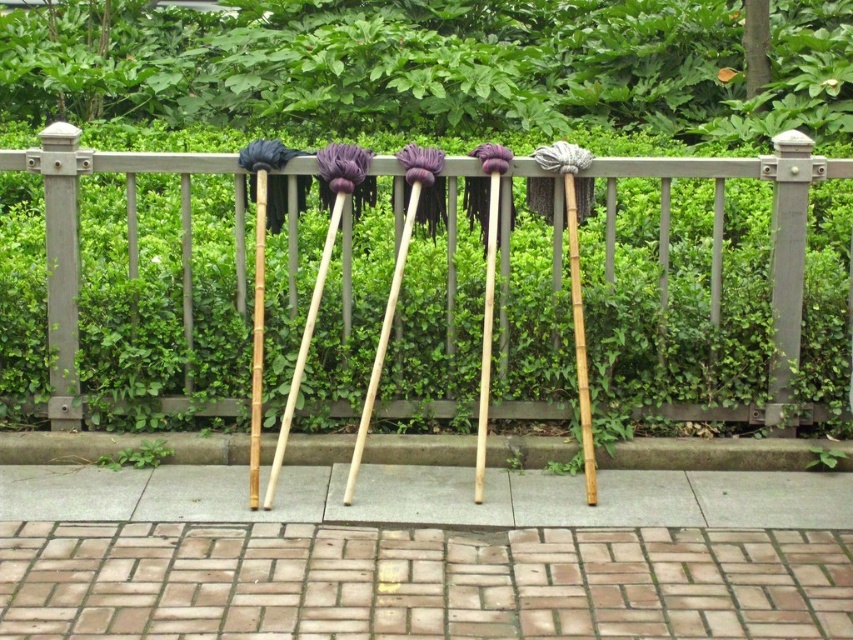
Question: Based on their relative distances, which object is farther from the green leafy hedge at upper center?

Choices:
 (A) wooden fence at center
 (B) brick paving at lower center

Answer: (B)

Question: Can you confirm if green leafy hedge at upper center is positioned below brick paving at lower center?

Choices:
 (A) yes
 (B) no

Answer: (B)

Question: Is wooden fence at center wider than green leafy hedge at upper center?

Choices:
 (A) yes
 (B) no

Answer: (A)

Question: Does wooden fence at center have a larger size compared to green leafy hedge at upper center?

Choices:
 (A) no
 (B) yes

Answer: (B)

Question: Which point is farther to the camera?

Choices:
 (A) (770, 605)
 (B) (775, 45)
 (C) (712, 196)

Answer: (B)

Question: Which point is closer to the camera?

Choices:
 (A) green leafy hedge at upper center
 (B) brick paving at lower center

Answer: (B)